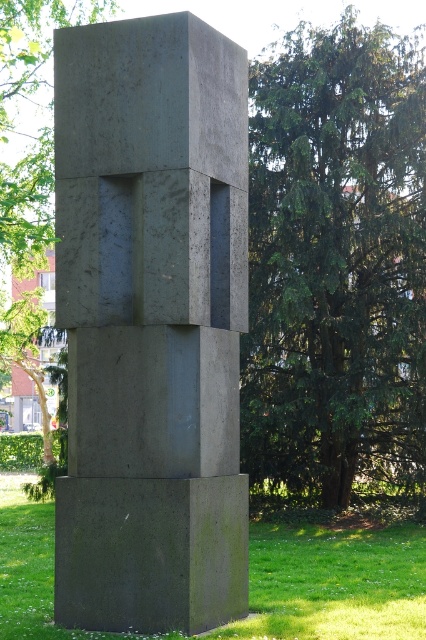
Is matte concrete sculpture at center wider than green textured tree at center?

Yes.

Is matte concrete sculpture at center positioned at the back of green textured tree at center?

No, matte concrete sculpture at center is in front of green textured tree at center.

Locate an element on the screen. The width and height of the screenshot is (426, 640). matte concrete sculpture at center is located at coordinates (150, 323).

Does green textured tree at center have a lesser width compared to green mossy stone at lower center?

Indeed, green textured tree at center has a lesser width compared to green mossy stone at lower center.

Which is above, green textured tree at center or green mossy stone at lower center?

green textured tree at center

What do you see at coordinates (336, 260) in the screenshot? I see `green textured tree at center` at bounding box center [336, 260].

You are a GUI agent. You are given a task and a screenshot of the screen. Output one action in this format:
    pyautogui.click(x=<x>, y=<y>)
    Task: Click on the green textured tree at center
    The height and width of the screenshot is (640, 426).
    Given the screenshot: What is the action you would take?
    pyautogui.click(x=336, y=260)

Which is more to the left, green mossy stone at lower center or green leafy tree at upper center?

From the viewer's perspective, green leafy tree at upper center appears more on the left side.

Does green mossy stone at lower center have a larger size compared to green leafy tree at upper center?

No.

Is point (235, 625) positioned behind point (22, 10)?

No.

Where is `green mossy stone at lower center`? Image resolution: width=426 pixels, height=640 pixels. green mossy stone at lower center is located at coordinates (333, 582).